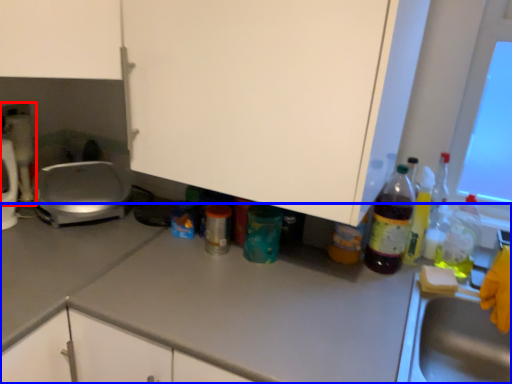
Question: Among these objects, which one is farthest to the camera, appliance (highlighted by a red box) or countertop (highlighted by a blue box)?

Choices:
 (A) appliance
 (B) countertop

Answer: (A)